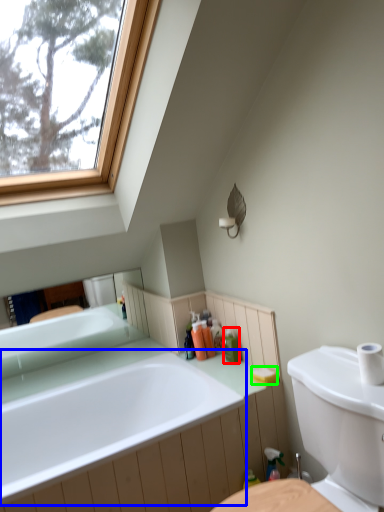
Question: Which object is the farthest from toiletry (highlighted by a red box)? Choose among these: bathtub (highlighted by a blue box) or soap (highlighted by a green box).

Choices:
 (A) bathtub
 (B) soap

Answer: (A)